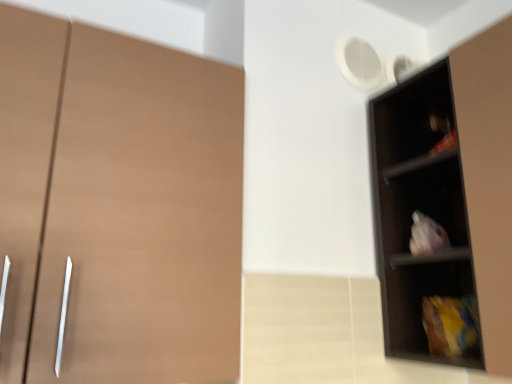
Question: Considering the relative positions of black matte shelf at right and matte brown cupboard at left in the image provided, is black matte shelf at right to the right of matte brown cupboard at left from the viewer's perspective?

Choices:
 (A) no
 (B) yes

Answer: (B)

Question: From the image's perspective, is black matte shelf at right located beneath matte brown cupboard at left?

Choices:
 (A) no
 (B) yes

Answer: (B)

Question: Is black matte shelf at right oriented towards matte brown cupboard at left?

Choices:
 (A) no
 (B) yes

Answer: (B)

Question: From the image's perspective, would you say black matte shelf at right is positioned over matte brown cupboard at left?

Choices:
 (A) no
 (B) yes

Answer: (A)

Question: Can you confirm if black matte shelf at right is shorter than matte brown cupboard at left?

Choices:
 (A) yes
 (B) no

Answer: (B)

Question: Does black matte shelf at right have a lesser width compared to matte brown cupboard at left?

Choices:
 (A) no
 (B) yes

Answer: (B)

Question: Does matte brown cupboard at left have a smaller size compared to black matte shelf at right?

Choices:
 (A) no
 (B) yes

Answer: (A)

Question: Is matte brown cupboard at left positioned before black matte shelf at right?

Choices:
 (A) yes
 (B) no

Answer: (A)

Question: From the image's perspective, does matte brown cupboard at left appear lower than black matte shelf at right?

Choices:
 (A) no
 (B) yes

Answer: (A)

Question: Is matte brown cupboard at left taller than black matte shelf at right?

Choices:
 (A) yes
 (B) no

Answer: (B)

Question: Does matte brown cupboard at left appear on the right side of black matte shelf at right?

Choices:
 (A) yes
 (B) no

Answer: (B)

Question: Is matte brown cupboard at left with black matte shelf at right?

Choices:
 (A) no
 (B) yes

Answer: (A)

Question: Considering the positions of matte brown cupboard at left and black matte shelf at right in the image, is matte brown cupboard at left wider or thinner than black matte shelf at right?

Choices:
 (A) wide
 (B) thin

Answer: (A)